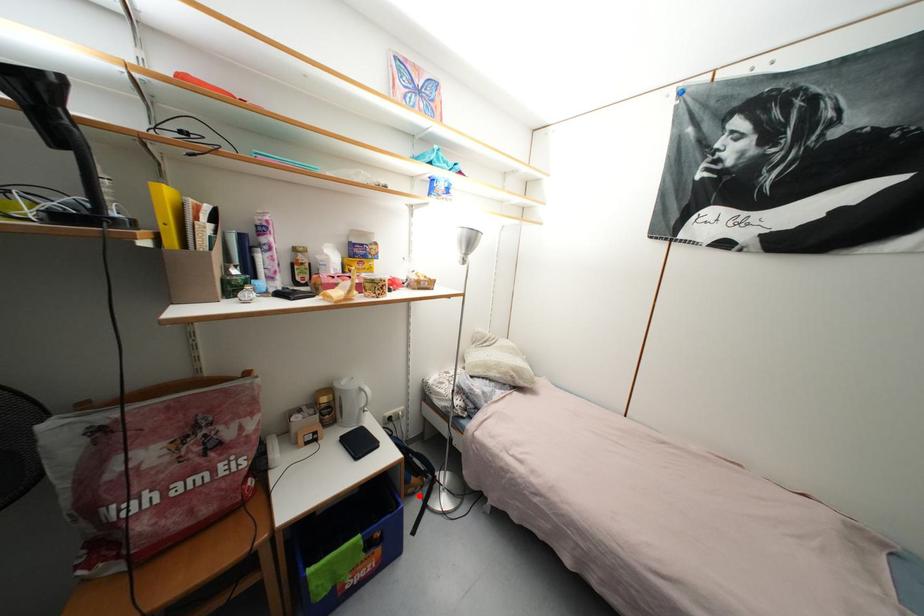
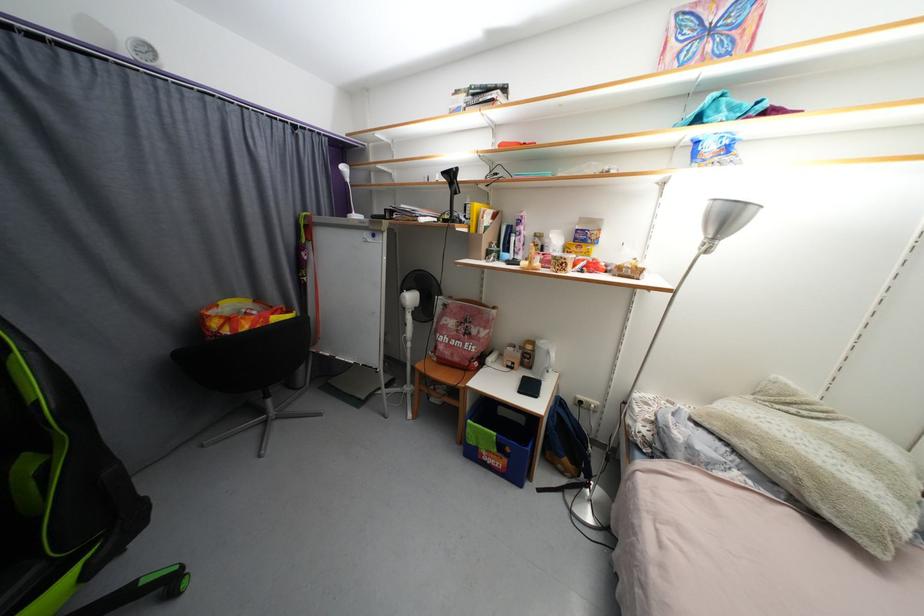
Question: I am providing you with two images of the same scene from different viewpoints. A red point is shown in image1. For the corresponding object point in image2, is it positioned nearer or farther from the camera?

Choices:
 (A) Nearer
 (B) Farther

Answer: (B)